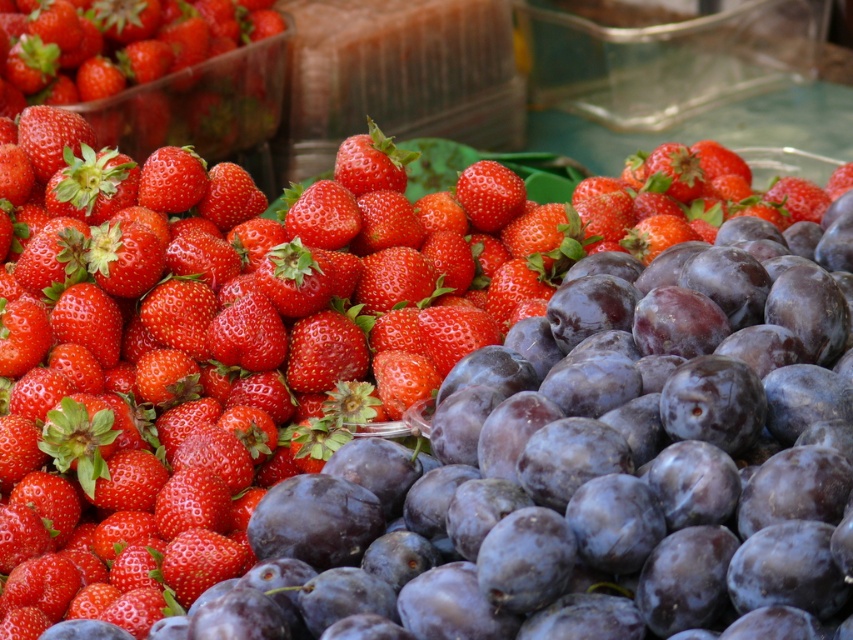
Based on the photo, you are a fruit seller who wants to arrange strawberries in a display. You have a small basket that can only hold strawberries narrower than 3 centimeters. Which strawberry between the matte red strawberry at upper left and the glossy red strawberry at center should you place in the basket?

The matte red strawberry at upper left has a width less than the glossy red strawberry at center, so the matte red strawberry at upper left should be placed in the basket since it is narrower and likely fits within the 3 centimeter limit.

You are standing in front of a fruit display and see a point marked at coordinates (171,179). What fruit is located exactly at that point?

The matte red strawberry at upper left is located at point (171,179).